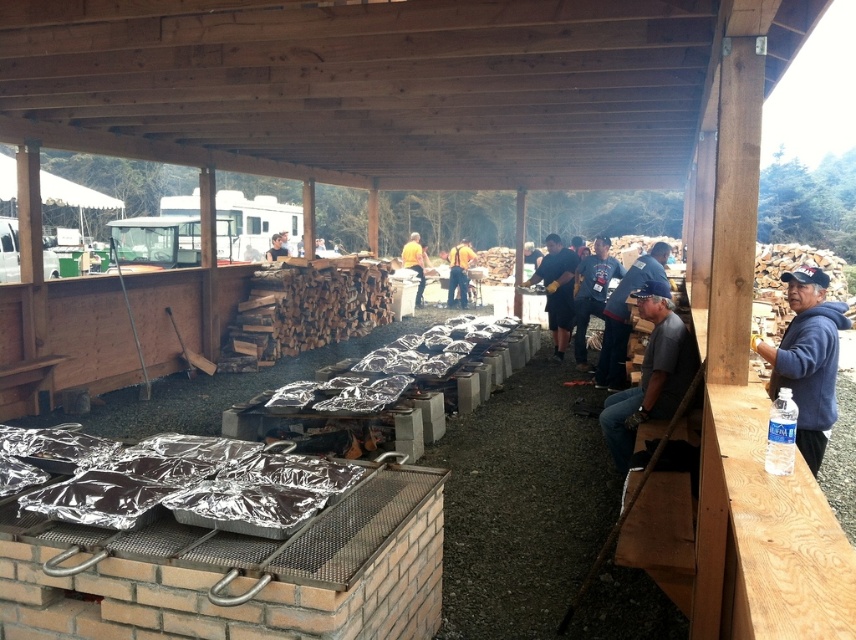
You are standing at the edge of the wooden pavilion and notice two people wearing the gray fabric shirt at center and the dark blue shirt at center. Which person is closer to the raised grill platform?

The gray fabric shirt at center is shorter than the dark blue shirt at center, so the gray fabric shirt at center is closer to the raised grill platform because shorter people are typically closer to the platform when standing at the same distance.

You are standing at the entrance of the wooden pavilion and want to find the dark blue shirt at center. Based on the coordinates provided, in which direction should you look to locate it?

The dark blue shirt at center is located at coordinates point (557, 289), which is slightly to the right and above the center point of the image. So you should look towards the upper right direction from the center to find it.

Where is the gray fabric shirt at center located in the image?

The gray fabric shirt at center is located at point (651, 374) in the image.